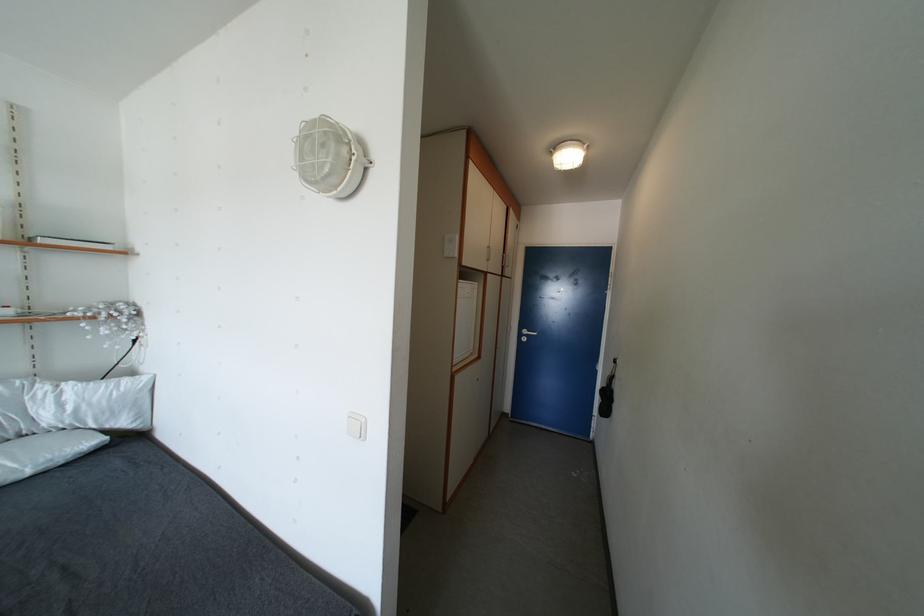
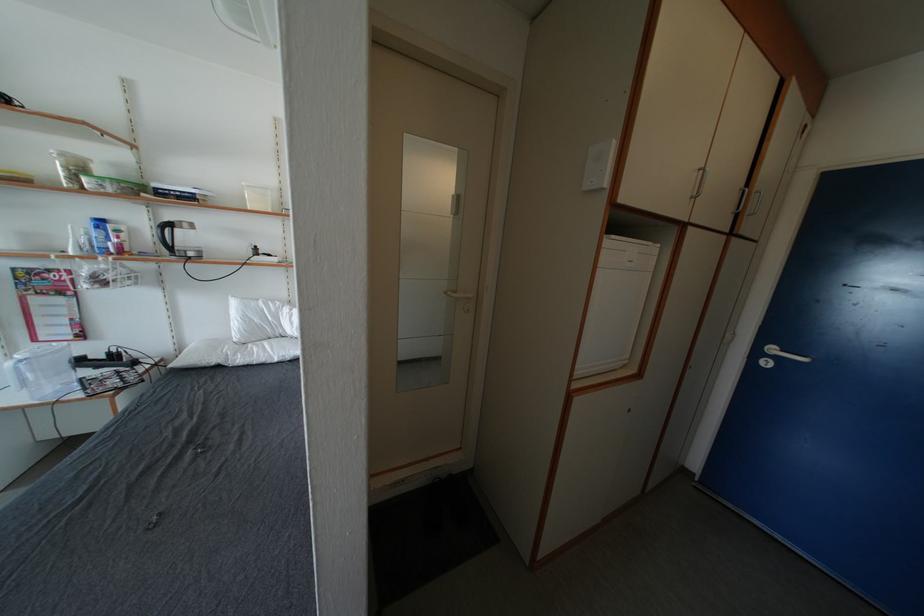
Question: The camera is either moving clockwise (left) or counter-clockwise (right) around the object. The first image is from the beginning of the video and the second image is from the end. Is the camera moving left or right when shooting the video?

Choices:
 (A) Left
 (B) Right

Answer: (B)